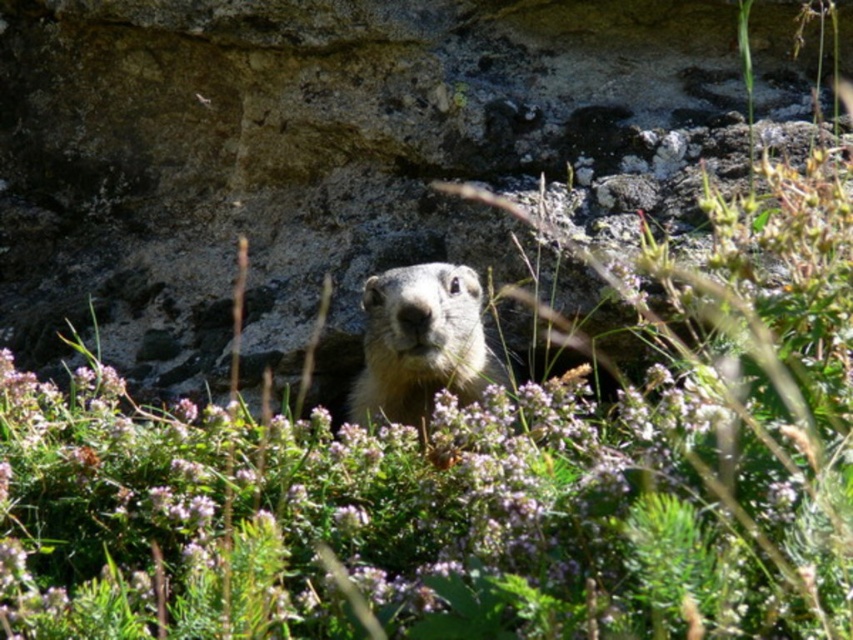
Question: Is gray rock at center to the left of furry brown ground squirrel at center from the viewer's perspective?

Choices:
 (A) no
 (B) yes

Answer: (B)

Question: Can you confirm if gray rock at center is positioned below furry brown ground squirrel at center?

Choices:
 (A) yes
 (B) no

Answer: (B)

Question: Which point appears farthest from the camera in this image?

Choices:
 (A) pos(682,86)
 (B) pos(492,381)

Answer: (A)

Question: Is gray rock at center above furry brown ground squirrel at center?

Choices:
 (A) yes
 (B) no

Answer: (A)